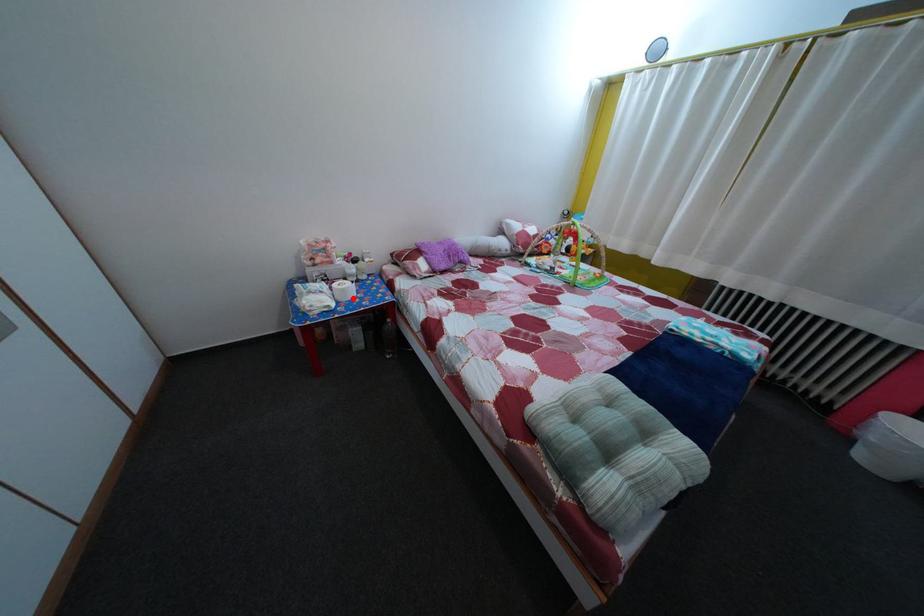
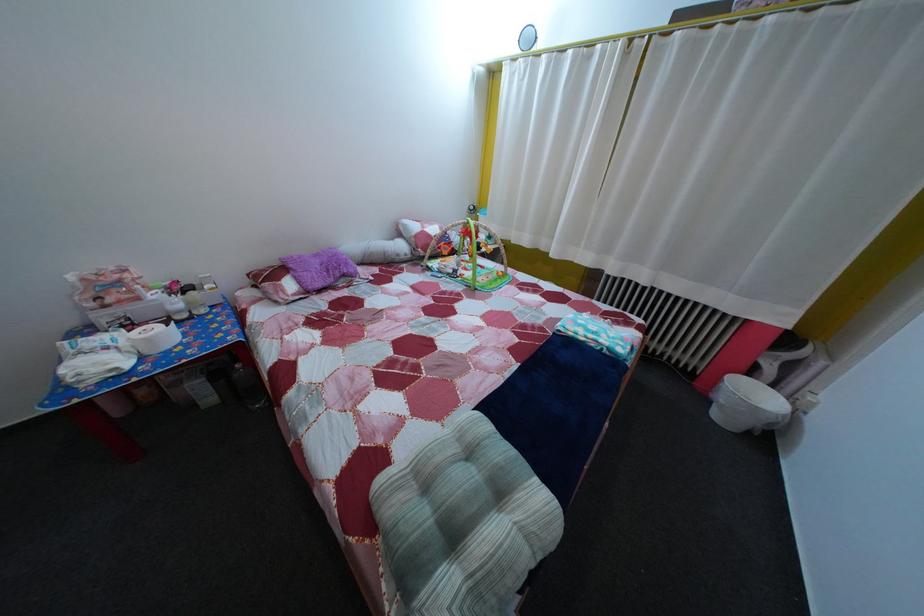
Question: I am providing you with two images of the same scene from different viewpoints. In image1, a red point is highlighted. Considering the same 3D point in image2, which of the following is correct?

Choices:
 (A) It is closer
 (B) It is farther

Answer: (B)